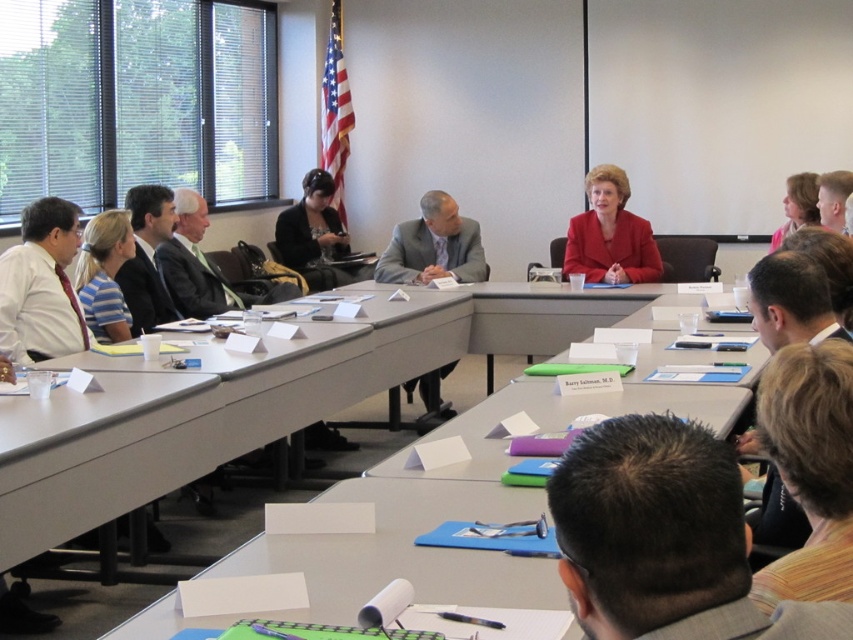
Question: Does white paper at center have a smaller size compared to brown hair at upper right?

Choices:
 (A) no
 (B) yes

Answer: (A)

Question: Which is nearer to the dark gray suit at left?

Choices:
 (A) gray suit at center
 (B) white paper at center
 (C) pink fabric at upper right

Answer: (A)

Question: Is dark gray suit at left smaller than brown hair at upper right?

Choices:
 (A) no
 (B) yes

Answer: (A)

Question: Is the position of blonde hair at lower right less distant than that of matte black suit at left?

Choices:
 (A) yes
 (B) no

Answer: (A)

Question: Among these points, which one is farthest from the camera?

Choices:
 (A) (825, 218)
 (B) (695, 552)
 (C) (373, 266)
 (D) (814, 179)

Answer: (C)

Question: Considering the real-world distances, which object is farthest from the striped cotton shirt at left?

Choices:
 (A) pink fabric at upper right
 (B) black fabric jacket at center
 (C) blonde hair at lower right
 (D) dark gray suit at left

Answer: (A)